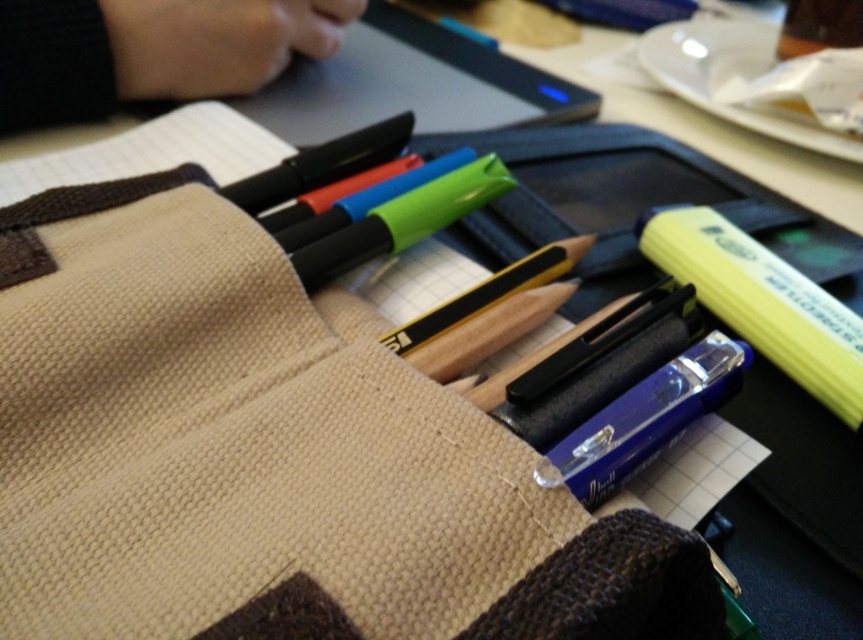
Who is taller, matte black pencil at center or matte blue highlighter at upper center?

matte black pencil at center

Who is positioned more to the left, matte black pencil at center or matte blue highlighter at upper center?

matte blue highlighter at upper center

Does point (394, 333) lie behind point (492, 49)?

No, (394, 333) is closer to viewer.

The width and height of the screenshot is (863, 640). Identify the location of matte black pencil at center. (489, 292).

Which is below, metallic blue pencil at center or green matte highlighter at center?

metallic blue pencil at center is lower down.

You are a GUI agent. You are given a task and a screenshot of the screen. Output one action in this format:
    pyautogui.click(x=<x>, y=<y>)
    Task: Click on the metallic blue pencil at center
    The image size is (863, 640).
    Given the screenshot: What is the action you would take?
    pyautogui.click(x=644, y=419)

Is the position of black fabric hand at upper left more distant than that of matte blue highlighter at upper center?

No.

How much distance is there between black fabric hand at upper left and matte blue highlighter at upper center?

black fabric hand at upper left and matte blue highlighter at upper center are 20.92 inches apart.

Is point (60, 45) behind point (492, 48)?

No, it is in front of (492, 48).

Find the location of `black fabric hand at upper left`. black fabric hand at upper left is located at coordinates (150, 51).